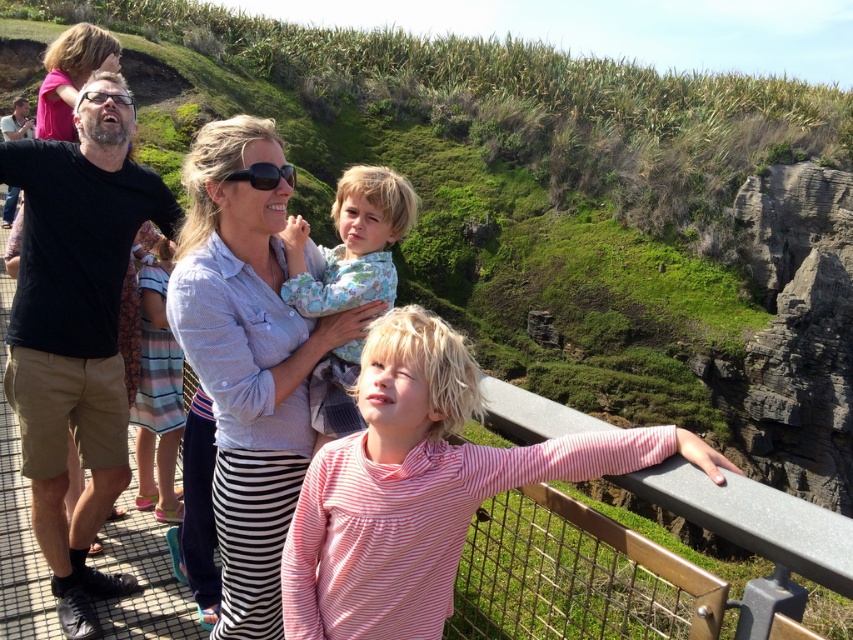
Who is more forward, (339, 532) or (9, 209)?

Point (339, 532) is in front.

Identify the location of pink striped shirt at center. (422, 486).

The image size is (853, 640). Identify the location of pink striped shirt at center. (422, 486).

Between black cotton shirt at left and clear plastic goggles at upper left, which one appears on the right side from the viewer's perspective?

clear plastic goggles at upper left

Is black cotton shirt at left closer to the viewer compared to clear plastic goggles at upper left?

Yes, black cotton shirt at left is in front of clear plastic goggles at upper left.

Locate an element on the screen. Image resolution: width=853 pixels, height=640 pixels. black cotton shirt at left is located at coordinates (76, 337).

What do you see at coordinates (245, 364) in the screenshot? I see `light blue shirt at center` at bounding box center [245, 364].

Is point (231, 150) closer to camera compared to point (28, 122)?

Yes, point (231, 150) is in front of point (28, 122).

You are a GUI agent. You are given a task and a screenshot of the screen. Output one action in this format:
    pyautogui.click(x=<x>, y=<y>)
    Task: Click on the light blue shirt at center
    Image resolution: width=853 pixels, height=640 pixels.
    Given the screenshot: What is the action you would take?
    pyautogui.click(x=245, y=364)